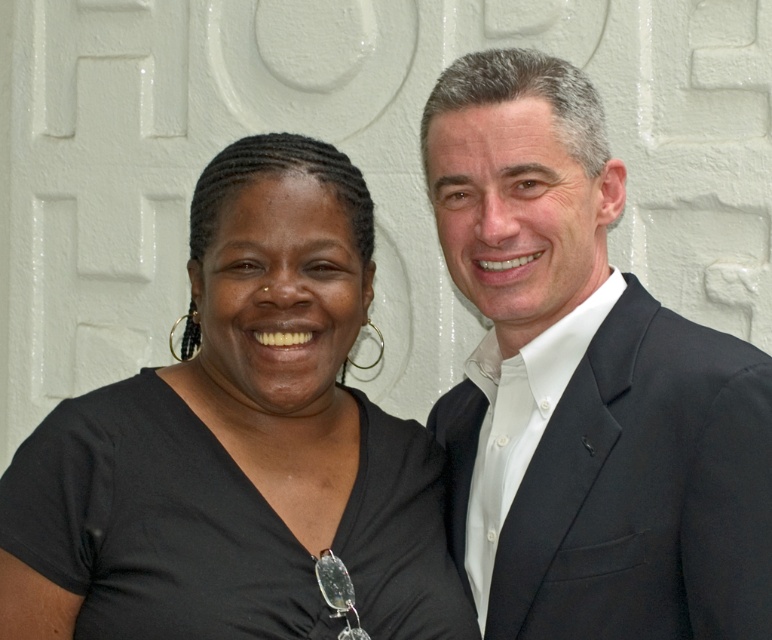
Question: From the image, what is the correct spatial relationship of black matte shirt at left in relation to black suit at right?

Choices:
 (A) left
 (B) right

Answer: (A)

Question: Is black matte shirt at left further to the viewer compared to black suit at right?

Choices:
 (A) no
 (B) yes

Answer: (B)

Question: Does black matte shirt at left lie in front of black suit at right?

Choices:
 (A) yes
 (B) no

Answer: (B)

Question: Which of the following is the farthest from the observer?

Choices:
 (A) black suit at right
 (B) black matte shirt at left

Answer: (B)